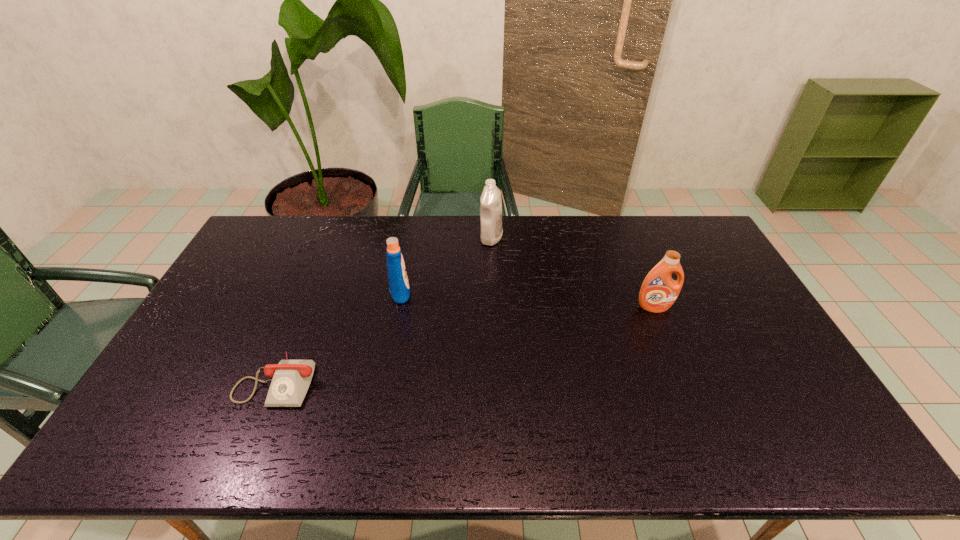
Identify the location of vacant space that satisfies the following two spatial constraints: 1. on the label of the second object from left to right; 2. on the dial of the leftmost object. This screenshot has height=540, width=960. (383, 380).

In order to click on vacant space that satisfies the following two spatial constraints: 1. on the label of the leftmost detergent; 2. on the dial of the leftmost object in this screenshot , I will do `click(383, 380)`.

The width and height of the screenshot is (960, 540). I want to click on free location that satisfies the following two spatial constraints: 1. on the label of the second object from left to right; 2. on the dial of the nearest object, so click(x=383, y=380).